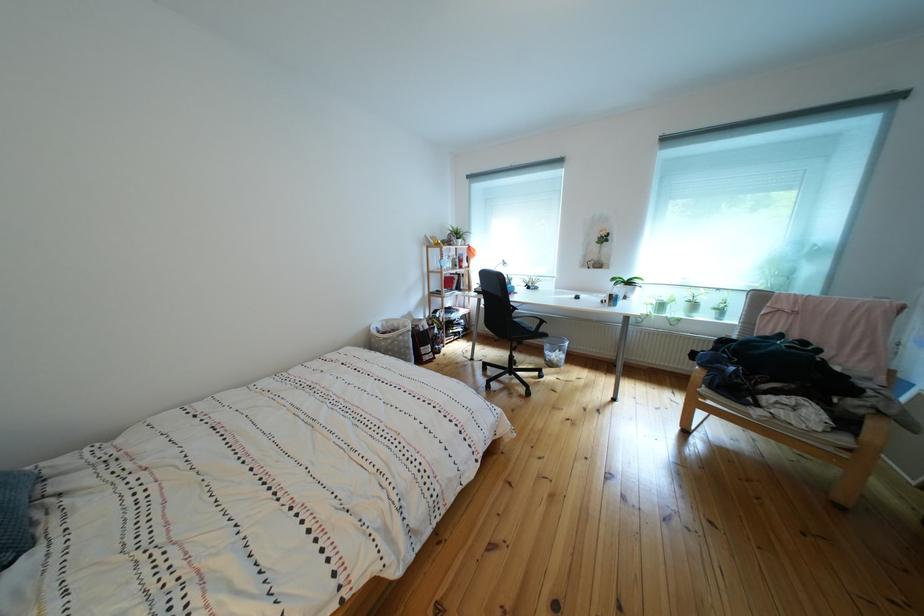
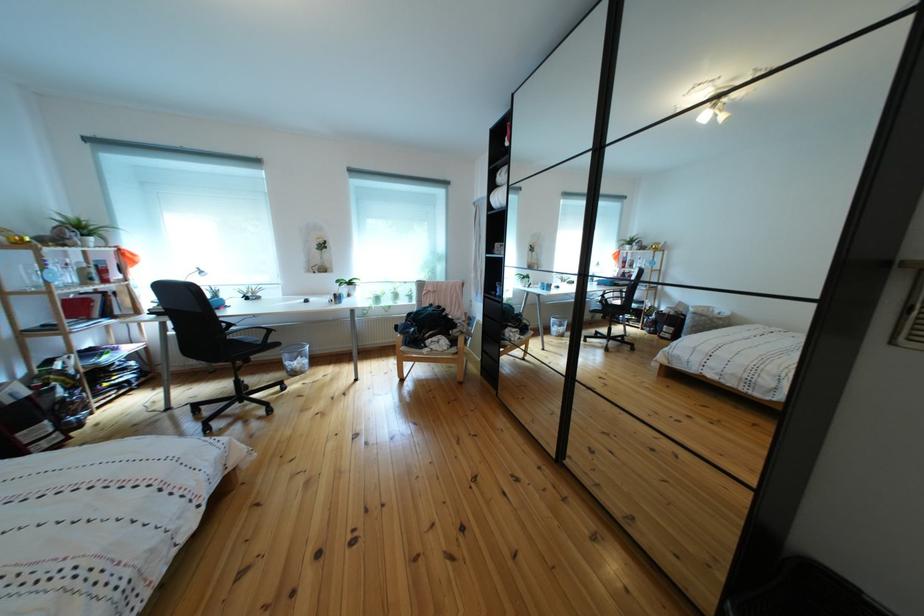
In the second image, find the point that corresponds to point 837,423 in the first image.

(458, 347)